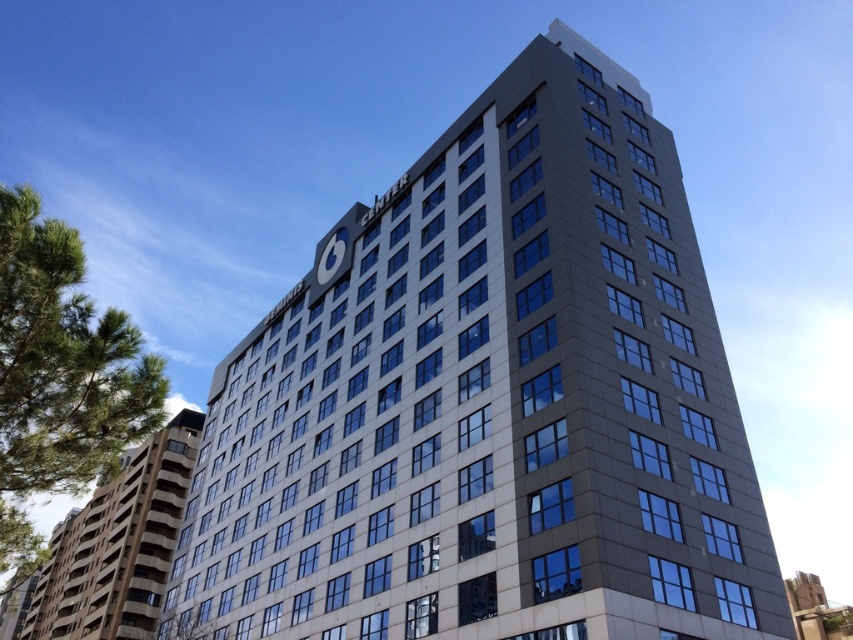
Identify the location of slate gray building at center. The height and width of the screenshot is (640, 853). (489, 403).

Which is below, slate gray building at center or gray concrete building at lower left?

gray concrete building at lower left is lower down.

Measure the distance between point (463, 344) and camera.

They are 135.95 feet apart.

This screenshot has width=853, height=640. I want to click on slate gray building at center, so click(x=489, y=403).